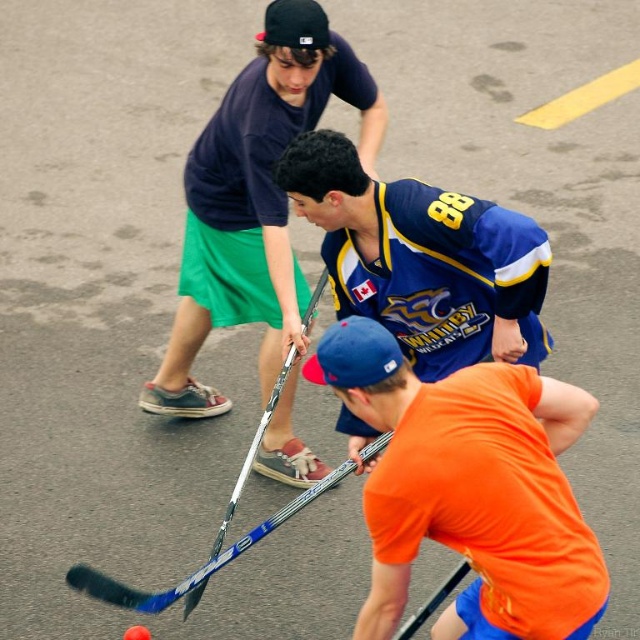
You are a referee observing the hockey game. You see two points marked on the field. The first point is at position (433, 476) and the second is at (308, 458). Which point is closer to the player in orange?

Point (433, 476) is in front of point (308, 458), so it is closer to the player in orange.

You are a referee observing the hockey game. You see the orange matte hockey stick at lower center and the matte black hockey stick at center. Which hockey stick is shorter in height?

The orange matte hockey stick at lower center is shorter in height compared to the matte black hockey stick at center.